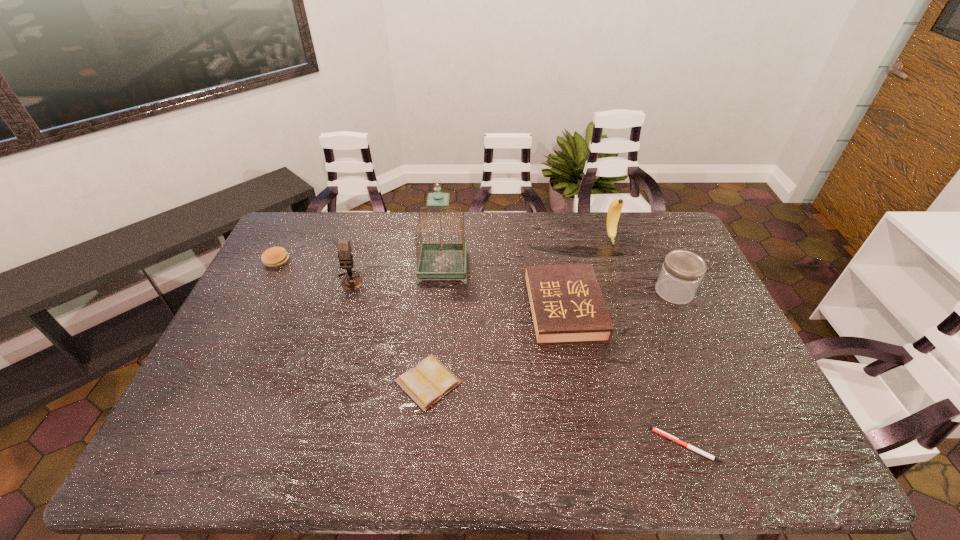
Identify the location of vacant space at the right edge of the desktop. Image resolution: width=960 pixels, height=540 pixels. (702, 321).

Where is `vacant space at the far left corner`? The image size is (960, 540). vacant space at the far left corner is located at coordinates (308, 228).

The height and width of the screenshot is (540, 960). I want to click on free location at the far right corner of the desktop, so click(x=663, y=228).

Locate an element on the screen. empty location between the seventh object from right to left and the patty is located at coordinates [x=314, y=271].

Identify the location of free area in between the tallest object and the shortest object. This screenshot has height=540, width=960. (564, 357).

Image resolution: width=960 pixels, height=540 pixels. Find the location of `vacant area that lies between the farthest object and the jar`. vacant area that lies between the farthest object and the jar is located at coordinates (642, 265).

Locate an element on the screen. The width and height of the screenshot is (960, 540). vacant region between the sixth tallest object and the rightmost object is located at coordinates (475, 276).

The image size is (960, 540). Find the location of `blank region between the fifth object from left to right and the pen`. blank region between the fifth object from left to right and the pen is located at coordinates (625, 377).

What are the coordinates of `empty space that is in between the fourth object from right to left and the leftmost object` in the screenshot? It's located at (x=420, y=285).

This screenshot has width=960, height=540. Find the location of `object that is the closest to the microphone`. object that is the closest to the microphone is located at coordinates (441, 259).